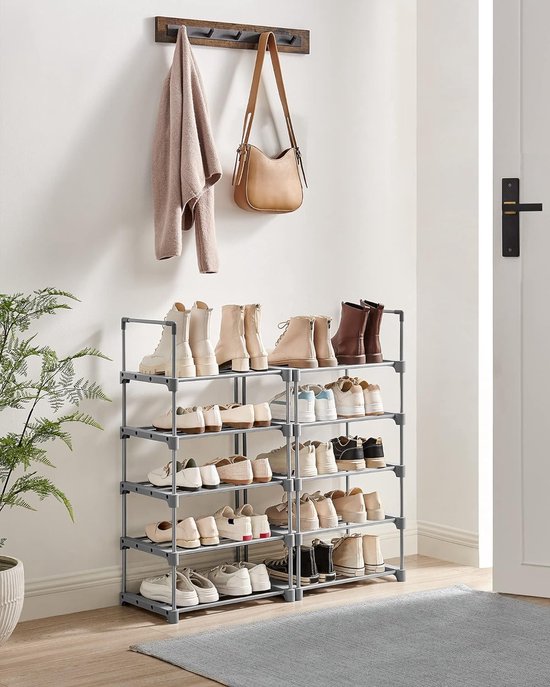
Locate an element on the screen. The height and width of the screenshot is (687, 550). shoes on top shelf is located at coordinates coord(182,349), coord(196,352), coord(236,350), coord(255,350), coord(299,358), coord(322,354), coord(345,347), coord(375,348).